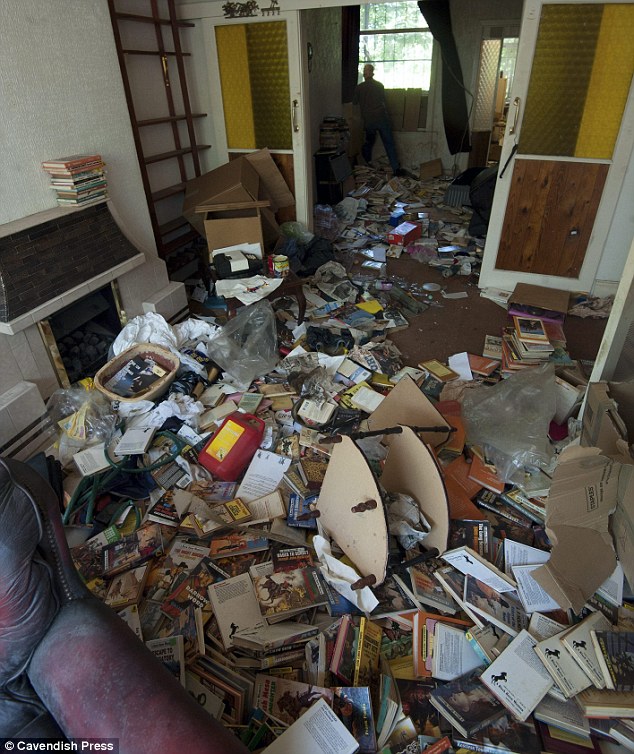
This screenshot has height=754, width=634. I want to click on bookcase, so click(x=167, y=121).